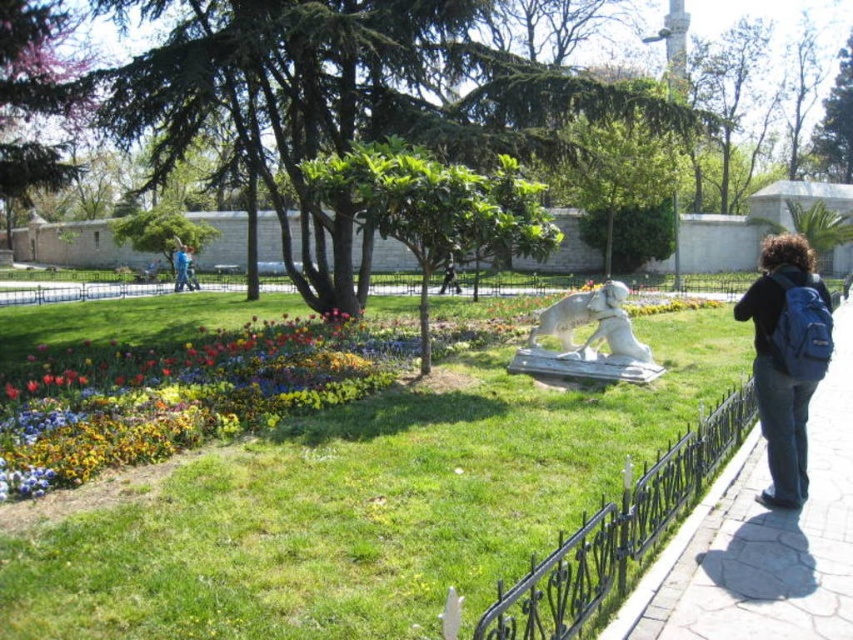
Does green grass at center appear over blue backpack at right?

No, green grass at center is not above blue backpack at right.

Which is in front, point (24, 547) or point (753, 317)?

Point (24, 547) is more forward.

Locate an element on the screen. green grass at center is located at coordinates (367, 506).

Which is more to the right, smooth concrete pavement at lower right or white marble statue at center?

smooth concrete pavement at lower right is more to the right.

Which is behind, point (697, 630) or point (558, 333)?

The point (558, 333) is behind.

The image size is (853, 640). I want to click on smooth concrete pavement at lower right, so click(x=762, y=541).

Does white marble statue at center have a lesser width compared to dark blue backpack at center?

No, white marble statue at center is not thinner than dark blue backpack at center.

Is white marble statue at center bigger than dark blue backpack at center?

No.

Where is `white marble statue at center`? This screenshot has width=853, height=640. white marble statue at center is located at coordinates (589, 340).

The width and height of the screenshot is (853, 640). Find the location of `white marble statue at center`. white marble statue at center is located at coordinates tap(589, 340).